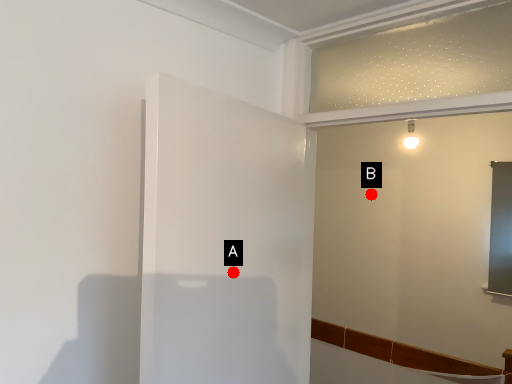
Question: Two points are circled on the image, labeled by A and B beside each circle. Which point appears closest to the camera in this image?

Choices:
 (A) A is closer
 (B) B is closer

Answer: (A)